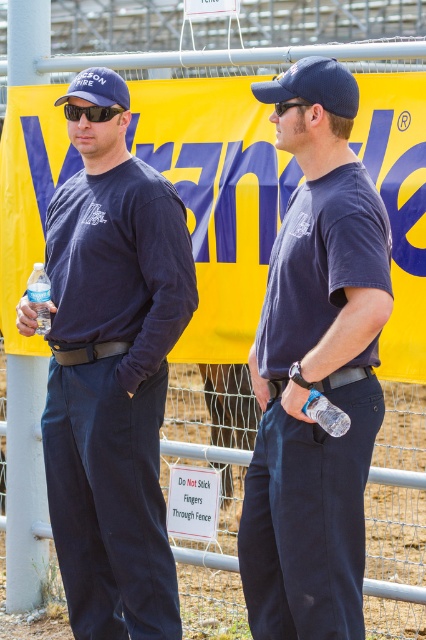
Question: Is clear plastic bottle at left bigger than black plastic goggles at center?

Choices:
 (A) yes
 (B) no

Answer: (A)

Question: Which is farther from the metal wire fence at lower center?

Choices:
 (A) blue mesh baseball cap at upper center
 (B) blue fabric cap at upper left
 (C) black plastic goggles at upper left

Answer: (A)

Question: Among these objects, which one is nearest to the camera?

Choices:
 (A) blue fabric cap at upper left
 (B) matte blue shirt at center
 (C) black plastic goggles at center
 (D) clear plastic bottle at left

Answer: (C)

Question: Is blue fabric cap at upper left to the right of clear plastic water bottle at lower center from the viewer's perspective?

Choices:
 (A) yes
 (B) no

Answer: (B)

Question: Does matte blue shirt at center lie in front of black plastic goggles at upper left?

Choices:
 (A) no
 (B) yes

Answer: (B)

Question: Which object is farther from the camera taking this photo?

Choices:
 (A) clear plastic water bottle at lower center
 (B) blue fabric cap at upper left
 (C) metal wire fence at lower center
 (D) blue mesh baseball cap at upper center

Answer: (C)